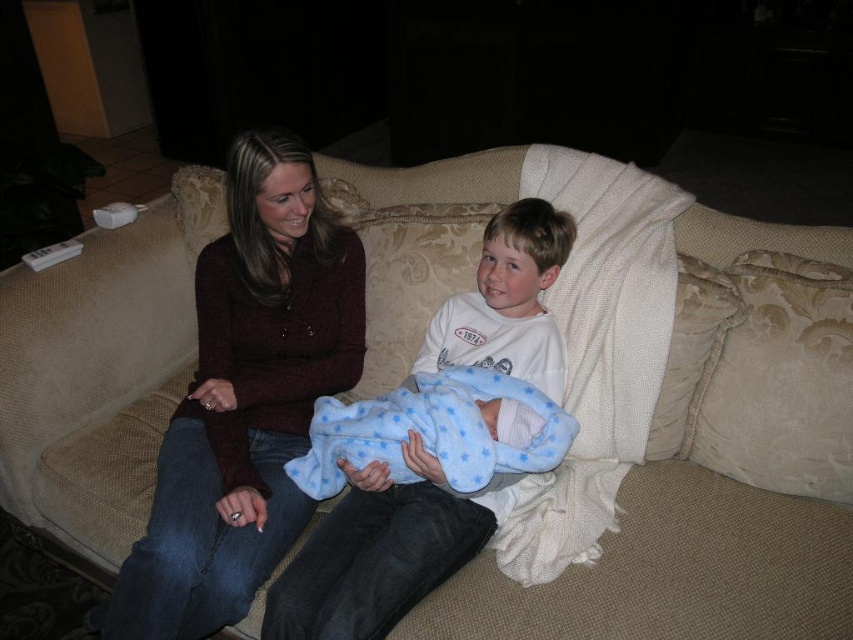
Can you confirm if white cotton shirt at center is positioned to the left of blue fleece blanket at center?

In fact, white cotton shirt at center is to the right of blue fleece blanket at center.

Which of these two, white cotton shirt at center or blue fleece blanket at center, stands taller?

With more height is white cotton shirt at center.

Where is `white cotton shirt at center`? The image size is (853, 640). white cotton shirt at center is located at coordinates (381, 548).

Does blue fleece blanket at center have a greater width compared to beige plush pillow at right?

Indeed, blue fleece blanket at center has a greater width compared to beige plush pillow at right.

Does blue fleece blanket at center appear under beige plush pillow at right?

Indeed, blue fleece blanket at center is positioned under beige plush pillow at right.

At what (x,y) coordinates should I click in order to perform the action: click on blue fleece blanket at center. Please return your answer as a coordinate pair (x, y). The image size is (853, 640). Looking at the image, I should click on (437, 433).

Which of these two, matte burgundy sweater at center or white cotton shirt at center, stands shorter?

Standing shorter between the two is white cotton shirt at center.

Is matte burgundy sweater at center below white cotton shirt at center?

Actually, matte burgundy sweater at center is above white cotton shirt at center.

Is point (235, 442) positioned before point (426, 458)?

No, it is behind (426, 458).

Identify the location of matte burgundy sweater at center. The image size is (853, 640). (245, 397).